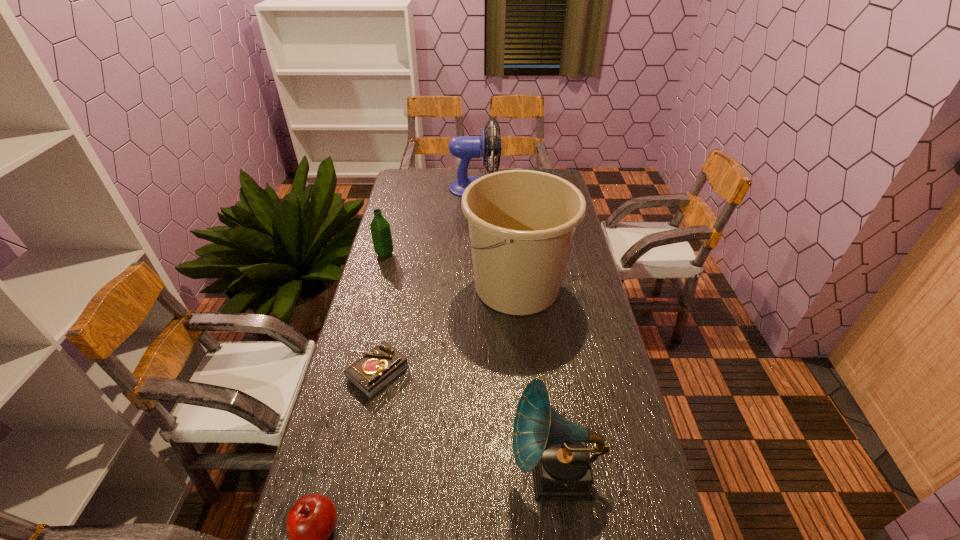
You are a GUI agent. You are given a task and a screenshot of the screen. Output one action in this format:
    pyautogui.click(x=<x>, y=<y>)
    Task: Click on the bucket
    
    Given the screenshot: What is the action you would take?
    pyautogui.click(x=522, y=223)

This screenshot has height=540, width=960. Identify the location of the farthest object. (464, 147).

What are the coordinates of `phonograph_record` in the screenshot? It's located at (555, 448).

In order to click on the fourth tallest object in this screenshot , I will do `click(380, 229)`.

Identify the location of diary. The image size is (960, 540). (377, 368).

I want to click on the fourth farthest object, so click(x=377, y=368).

The image size is (960, 540). What are the coordinates of `vacant space located on the back of the bucket` in the screenshot? It's located at [x=512, y=228].

Where is `vacant region located 0.060m in front of the fan where the airflow is directed`? vacant region located 0.060m in front of the fan where the airflow is directed is located at coordinates (513, 187).

At what (x,y) coordinates should I click in order to perform the action: click on free point located 0.220m from the horn of the phonograph_record. Please return your answer as a coordinate pair (x, y). Image resolution: width=960 pixels, height=540 pixels. Looking at the image, I should click on (420, 472).

The image size is (960, 540). In order to click on vacant area situated from the horn of the phonograph_record in this screenshot , I will do `click(441, 472)`.